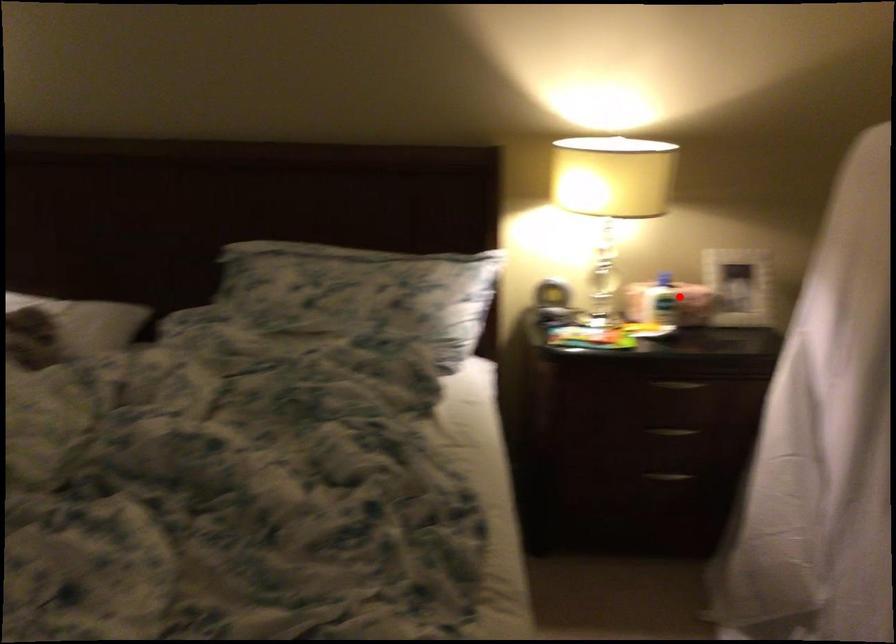
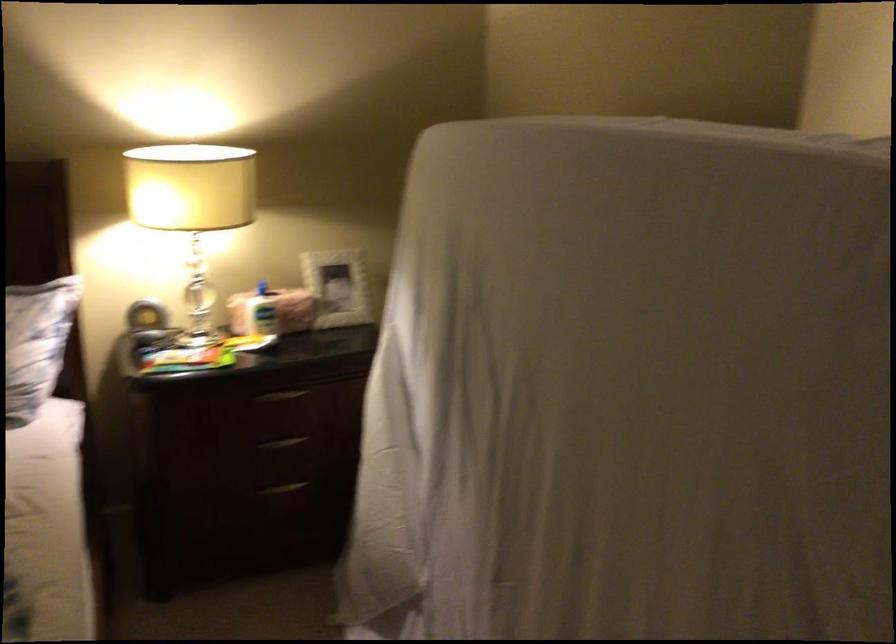
Find the pixel in the second image that matches the highlighted location in the first image.

(273, 310)